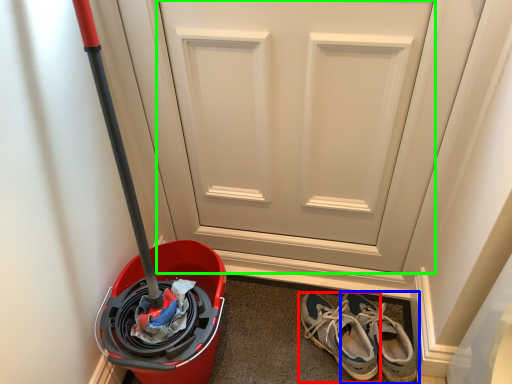
Question: Which is farther away from footwear (highlighted by a red box)? footwear (highlighted by a blue box) or door (highlighted by a green box)?

Choices:
 (A) footwear
 (B) door

Answer: (B)